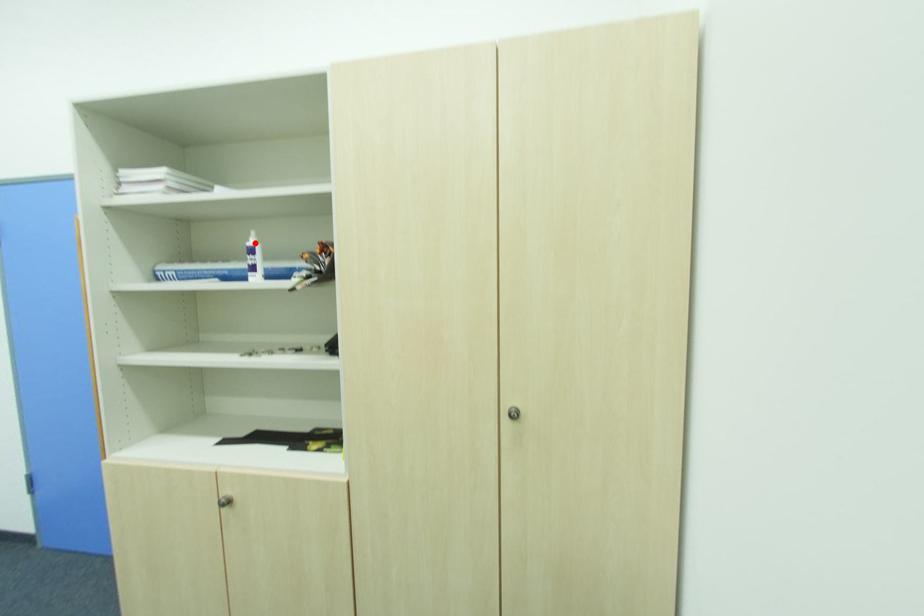
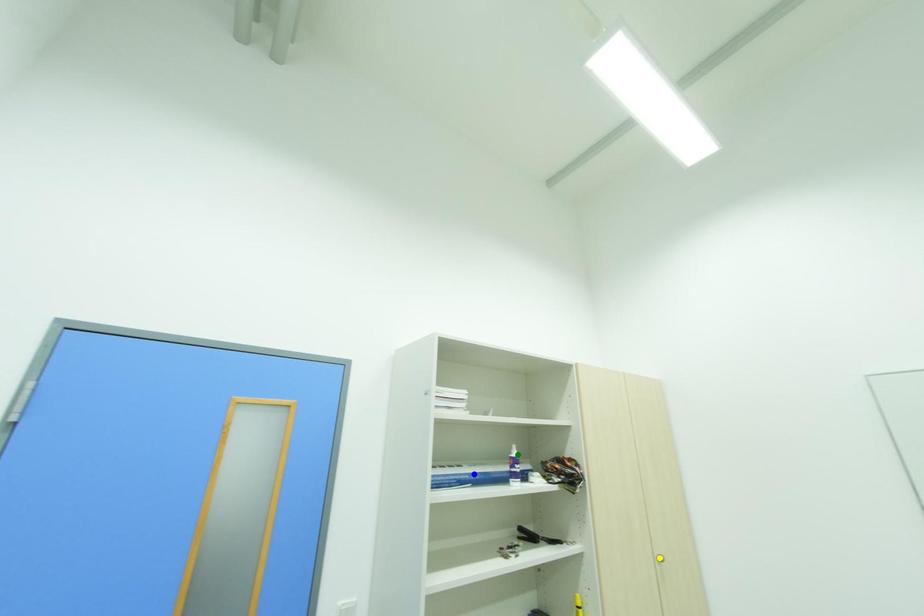
Question: I am providing you with two images of the same scene from different viewpoints. A red point is marked on the first image. You are given multiple points on the second image. Which mark in image 2 goes with the point in image 1?

Choices:
 (A) blue point
 (B) yellow point
 (C) green point

Answer: (C)